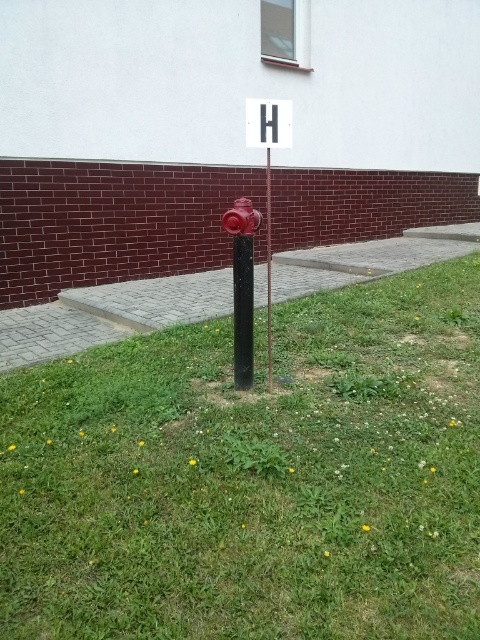
You are a delivery person trying to locate the fire hydrant. You see the white plastic sign at upper center and the metallic red fire hydrant at center. According to the scene, which object is positioned to the right of the other?

The metallic red fire hydrant at center is to the right of the white plastic sign at upper center.

You are a gardener who wants to plant a new flower bed between the green grass at center and the glossy red fire hydrant at center. Considering their widths, which area should you choose to ensure the flower bed fits without overlapping either object?

The green grass at center is wider than the glossy red fire hydrant at center. Therefore, you should plant the flower bed next to the glossy red fire hydrant at center since its narrower width allows more space for the flower bed without overlapping.